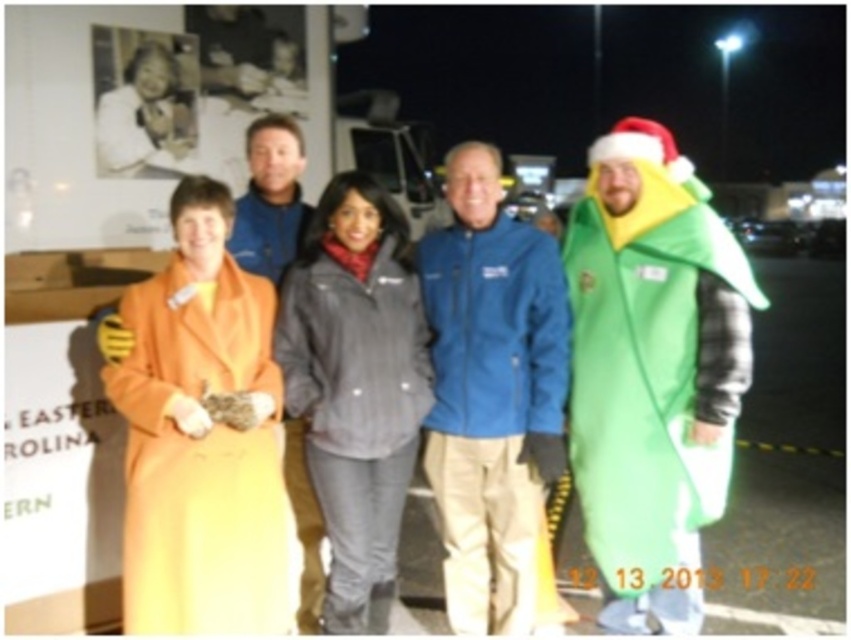
Can you confirm if green fuzzy onesie at right is taller than gray synthetic jacket at center?

Correct, green fuzzy onesie at right is much taller as gray synthetic jacket at center.

Which of these two, green fuzzy onesie at right or gray synthetic jacket at center, stands shorter?

A: With less height is gray synthetic jacket at center.

I want to click on green fuzzy onesie at right, so click(652, 372).

Does orange woolen coat at left lie in front of gray synthetic jacket at center?

Yes, orange woolen coat at left is in front of gray synthetic jacket at center.

Does point (206, 356) come in front of point (309, 376)?

Yes, it is in front of point (309, 376).

I want to click on orange woolen coat at left, so click(x=201, y=458).

Is point (521, 225) positioned after point (271, 268)?

No, it is in front of (271, 268).

Describe the element at coordinates (490, 392) in the screenshot. The height and width of the screenshot is (640, 851). I see `blue softshell jacket at center` at that location.

Where is `blue softshell jacket at center`? blue softshell jacket at center is located at coordinates (490, 392).